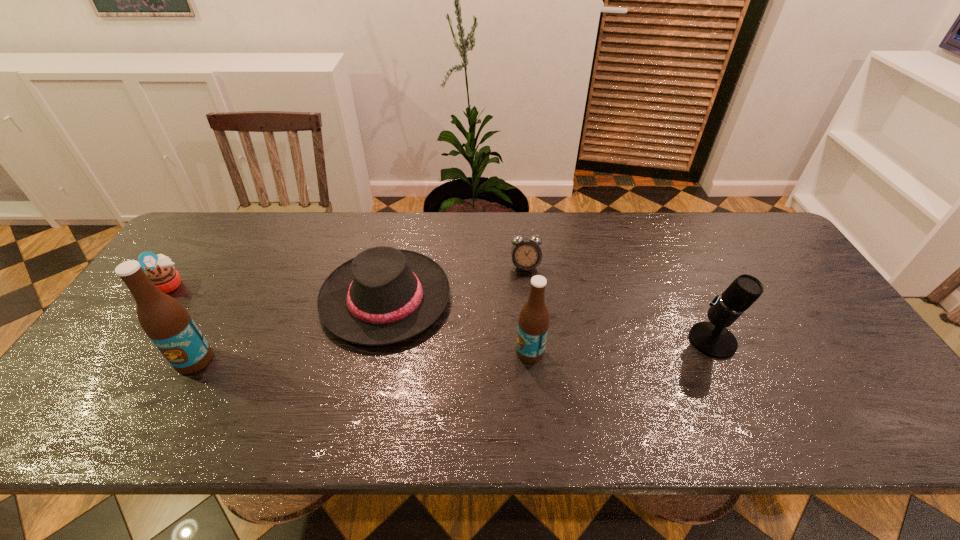
This screenshot has height=540, width=960. What are the coordinates of `blank space at the left edge of the desktop` in the screenshot? It's located at (152, 359).

Identify the location of vacant space at the right edge. The image size is (960, 540). (804, 320).

The height and width of the screenshot is (540, 960). In the image, there is a desktop. What are the coordinates of `vacant area at the far left corner` in the screenshot? It's located at (212, 248).

Locate an element on the screen. Image resolution: width=960 pixels, height=540 pixels. vacant space at the far right corner is located at coordinates (732, 245).

This screenshot has height=540, width=960. I want to click on vacant area that lies between the third tallest object and the tallest object, so click(x=453, y=350).

In order to click on free space between the alarm clock and the third object from left to right in this screenshot , I will do [455, 282].

You are a GUI agent. You are given a task and a screenshot of the screen. Output one action in this format:
    pyautogui.click(x=<x>, y=<y>)
    Task: Click on the free spot between the leftmost object and the third object from left to right
    The width and height of the screenshot is (960, 540).
    Given the screenshot: What is the action you would take?
    pyautogui.click(x=277, y=292)

Where is `vacant space in between the dress hat and the alarm clock`? The width and height of the screenshot is (960, 540). vacant space in between the dress hat and the alarm clock is located at coordinates (455, 282).

Locate an element on the screen. The width and height of the screenshot is (960, 540). free space between the alarm clock and the microphone is located at coordinates (619, 303).

Where is `free spot between the muffin and the dress hat`? Image resolution: width=960 pixels, height=540 pixels. free spot between the muffin and the dress hat is located at coordinates (277, 292).